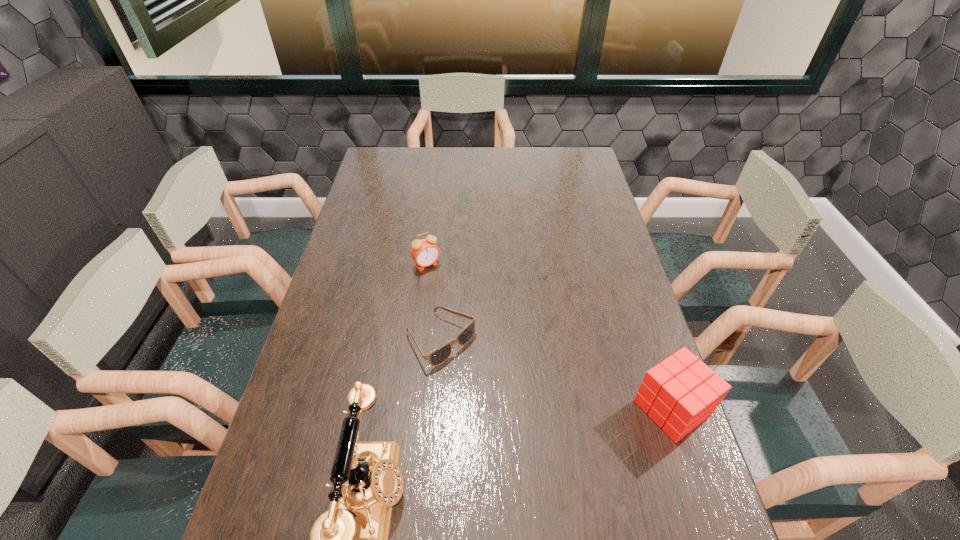
Image resolution: width=960 pixels, height=540 pixels. I want to click on vacant point located on the frames of the second farthest object, so click(x=578, y=456).

Identify the location of object that is at the right edge. This screenshot has width=960, height=540. (680, 393).

Find the location of a particular element. The width and height of the screenshot is (960, 540). vacant area at the far edge is located at coordinates (423, 159).

In the image, there is a desktop. At what (x,y) coordinates should I click in order to perform the action: click on vacant space at the left edge. Please return your answer as a coordinate pair (x, y). This screenshot has height=540, width=960. Looking at the image, I should click on (369, 194).

Identify the location of free space at the right edge of the desktop. Image resolution: width=960 pixels, height=540 pixels. (583, 197).

The image size is (960, 540). Identify the location of vacant space at the far left corner of the desktop. (382, 162).

In the image, there is a desktop. Where is `vacant space at the near left corner`? vacant space at the near left corner is located at coordinates (296, 489).

The width and height of the screenshot is (960, 540). Identify the location of vacant space at the far right corner. (567, 156).

Image resolution: width=960 pixels, height=540 pixels. Identify the location of free space between the cube and the sunglasses. (556, 374).

The image size is (960, 540). I want to click on free point between the farthest object and the cube, so 549,336.